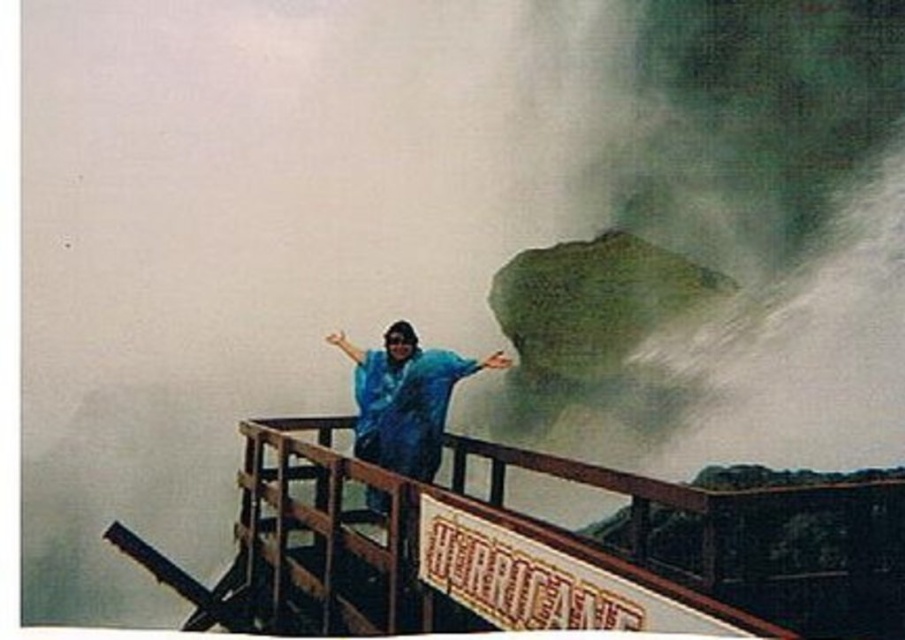
You are a tourist visiting the Horse Shoe Falls. You want to take a photo of the blue waterproof jacket at center while ensuring the brown wooden rail at center is also in the frame. Based on their positions, which side of the jacket should you position the rail to capture both in the photo?

The brown wooden rail at center is to the left of the blue waterproof jacket at center, so to capture both in the photo, position the rail to the left side of the jacket.

You are a park ranger at Horse Shoe Falls and need to ensure visitors can safely hold onto the brown wooden rail at center while wearing their blue waterproof jacket at center. Given the jacket is loose, will the rail be wide enough for a hand to grasp comfortably?

The brown wooden rail at center has a width less than the blue waterproof jacket at center, so it may not be wide enough for a hand to grasp comfortably while wearing the loose jacket.

You are a park ranger at the observation platform near the Horse Shoe Falls. You need to secure a safety net that must be attached to the brown wooden rail at center. According to the coordinates provided, where exactly should you position the net relative to the rail?

The brown wooden rail at center is located at point (567,538), so the safety net should be positioned at those coordinates to secure it properly.